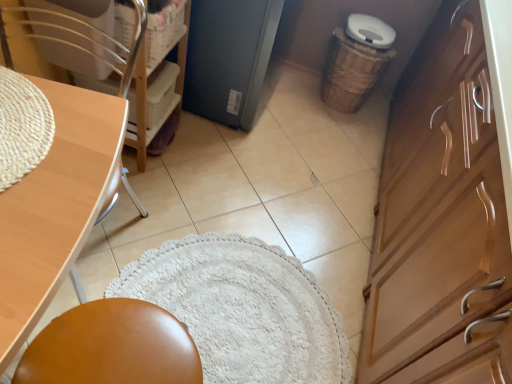
The height and width of the screenshot is (384, 512). Identify the location of vacant space to the left of woven brown basket at right, the 1th basket when ordered from right to left. (292, 91).